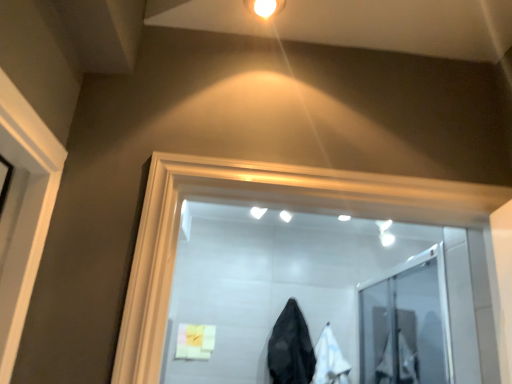
Question: Does black matte coat at center, the first garment positioned from the left, have a smaller size compared to white fabric at center, which is the 2th garment in left-to-right order?

Choices:
 (A) no
 (B) yes

Answer: (A)

Question: Does black matte coat at center, the 2th garment viewed from the right, appear on the left side of white fabric at center, which ranks as the first garment in right-to-left order?

Choices:
 (A) yes
 (B) no

Answer: (A)

Question: Can you confirm if black matte coat at center, the 2th garment viewed from the right, is wider than white fabric at center, which ranks as the first garment in right-to-left order?

Choices:
 (A) no
 (B) yes

Answer: (B)

Question: Would you consider black matte coat at center, the 2th garment viewed from the right, to be distant from white fabric at center, which is the 2th garment in left-to-right order?

Choices:
 (A) no
 (B) yes

Answer: (A)

Question: Is black matte coat at center, the first garment positioned from the left, next to white fabric at center, which ranks as the first garment in right-to-left order?

Choices:
 (A) no
 (B) yes

Answer: (A)

Question: Is black matte coat at center, the 2th garment viewed from the right, bigger or smaller than white fabric at center, which ranks as the first garment in right-to-left order?

Choices:
 (A) small
 (B) big

Answer: (B)

Question: Is point (308, 369) closer or farther from the camera than point (328, 340)?

Choices:
 (A) closer
 (B) farther

Answer: (A)

Question: Looking at their shapes, would you say black matte coat at center, the first garment positioned from the left, is wider or thinner than white fabric at center, which ranks as the first garment in right-to-left order?

Choices:
 (A) wide
 (B) thin

Answer: (A)

Question: From the image's perspective, is black matte coat at center, the 2th garment viewed from the right, located above or below white fabric at center, which is the 2th garment in left-to-right order?

Choices:
 (A) below
 (B) above

Answer: (B)

Question: Choose the correct answer: Is transparent glass door at center inside white fabric at center, which is the 2th garment in left-to-right order, or outside it?

Choices:
 (A) outside
 (B) inside

Answer: (A)

Question: Relative to white fabric at center, which ranks as the first garment in right-to-left order, is transparent glass door at center in front or behind?

Choices:
 (A) behind
 (B) front

Answer: (A)

Question: Considering the positions of transparent glass door at center and white fabric at center, which ranks as the first garment in right-to-left order, in the image, is transparent glass door at center taller or shorter than white fabric at center, which ranks as the first garment in right-to-left order,?

Choices:
 (A) short
 (B) tall

Answer: (B)

Question: In the image, is transparent glass door at center on the left side or the right side of white fabric at center, which ranks as the first garment in right-to-left order?

Choices:
 (A) left
 (B) right

Answer: (B)

Question: In terms of width, does transparent glass door at center look wider or thinner when compared to soft yellow cloth at lower center?

Choices:
 (A) wide
 (B) thin

Answer: (A)

Question: Is transparent glass door at center bigger or smaller than soft yellow cloth at lower center?

Choices:
 (A) big
 (B) small

Answer: (A)